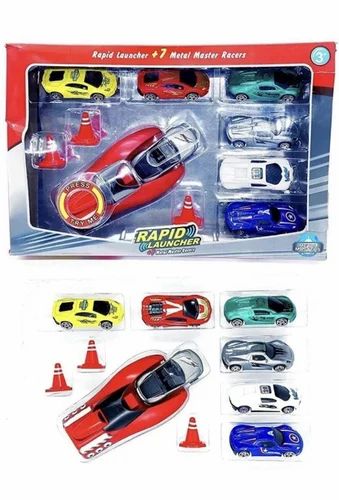
This screenshot has height=500, width=339. Identify the location of box. (13, 133).